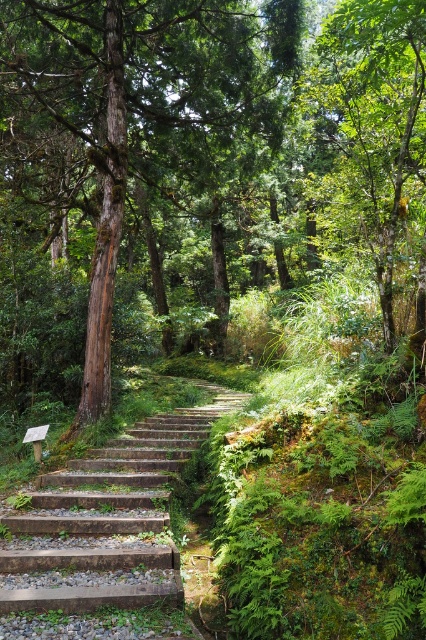
You are a hiker trying to reach the top of the slope. You see the brown wood tree at center and the stone steps at center. Which one should you follow to ascend the slope?

The stone steps at center are the path leading up the slope, so you should follow the stone steps at center to ascend the slope since they are designed for climbing, whereas the brown wood tree at center is stationary and cannot be followed for ascent.

You are standing at the bottom of the stone steps in the forest scene. You notice a point marked at coordinates [132,140]. Which object does this point correspond to?

The point corresponds to the brown wood tree at center.